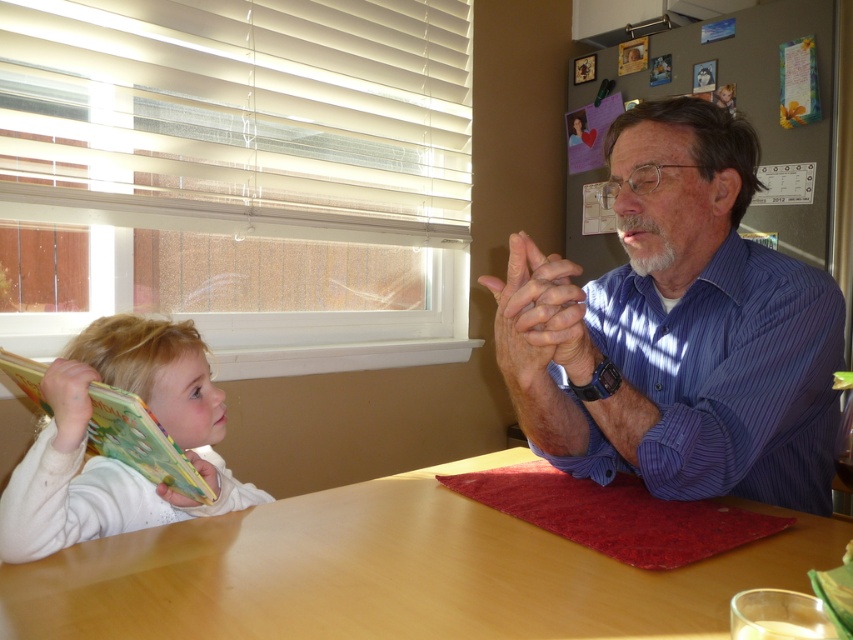
Question: Is white plastic blinds at upper left above blue striped shirt at center?

Choices:
 (A) yes
 (B) no

Answer: (A)

Question: Which of these objects is positioned farthest from the white plastic blinds at upper left?

Choices:
 (A) white cloth book at left
 (B) wooden table at center
 (C) blue striped shirt at center

Answer: (C)

Question: Which of these objects is positioned farthest from the white plastic blinds at upper left?

Choices:
 (A) white cloth book at left
 (B) wooden table at center

Answer: (B)

Question: Is blue striped shirt at center positioned behind white cloth book at left?

Choices:
 (A) yes
 (B) no

Answer: (B)

Question: Which of the following is the farthest from the observer?

Choices:
 (A) (704, 170)
 (B) (726, 580)
 (C) (190, 330)
 (D) (25, 120)

Answer: (D)

Question: Does white plastic blinds at upper left appear under white cloth book at left?

Choices:
 (A) no
 (B) yes

Answer: (A)